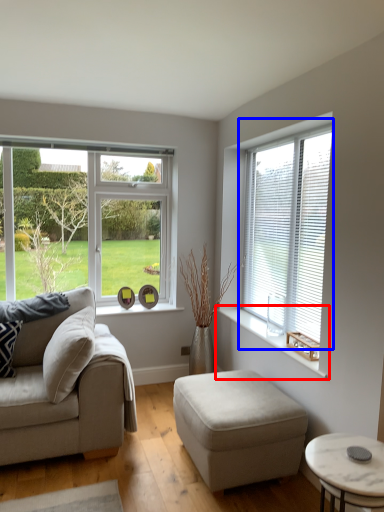
Question: Among these objects, which one is farthest to the camera, window sill (highlighted by a red box) or window (highlighted by a blue box)?

Choices:
 (A) window sill
 (B) window

Answer: (B)